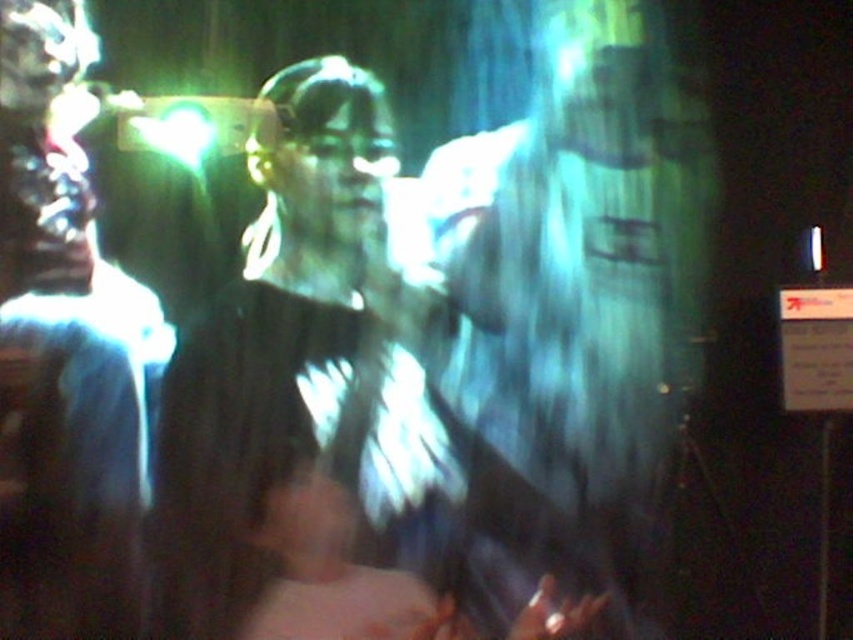
Question: Among these objects, which one is farthest from the camera?

Choices:
 (A) matte black shirt at center
 (B) matte black jacket at center
 (C) translucent plastic bag at center

Answer: (C)

Question: Can you confirm if translucent plastic bag at center is positioned to the left of matte black shirt at center?

Choices:
 (A) no
 (B) yes

Answer: (A)

Question: Can you confirm if translucent plastic bag at center is positioned to the left of matte black shirt at center?

Choices:
 (A) no
 (B) yes

Answer: (A)

Question: Which point appears farthest from the camera in this image?

Choices:
 (A) (376, 177)
 (B) (117, 488)

Answer: (A)

Question: Which of the following is the closest to the observer?

Choices:
 (A) (610, 387)
 (B) (28, 172)
 (C) (331, 438)

Answer: (B)

Question: Does matte black shirt at center appear on the right side of matte black jacket at center?

Choices:
 (A) yes
 (B) no

Answer: (A)